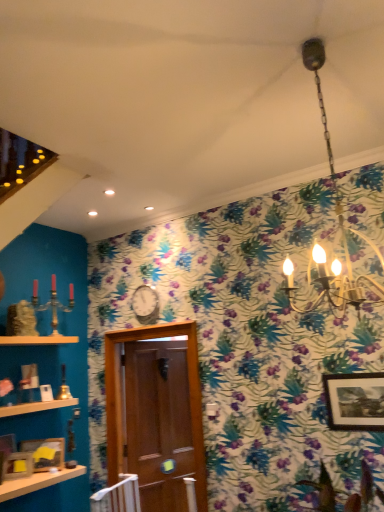
Question: From the image's perspective, is wooden picture frame at upper right, arranged as the fourth picture frame when viewed from the left, above or below wooden picture frame at lower left, positioned as the 2th picture frame in right-to-left order?

Choices:
 (A) above
 (B) below

Answer: (A)

Question: From a real-world perspective, relative to wooden picture frame at lower left, positioned as the 2th picture frame in right-to-left order, is wooden picture frame at upper right, the 1th picture frame positioned from the right, vertically above or below?

Choices:
 (A) above
 (B) below

Answer: (A)

Question: Estimate the real-world distances between objects in this image. Which object is farther from the wooden photo frame at lower left, positioned as the 2th picture frame in left-to-right order?

Choices:
 (A) wooden shelf at lower left, marked as the 1th shelf in a bottom-to-top arrangement
 (B) wooden shelf at lower left
 (C) wooden shelf at lower left, the 1th shelf positioned from the top
 (D) wooden picture frame at upper right, arranged as the fourth picture frame when viewed from the left
 (E) brown wooden door at center

Answer: (D)

Question: Estimate the real-world distances between objects in this image. Which object is farther from the wooden shelf at lower left, the 2th shelf when ordered from top to bottom?

Choices:
 (A) gold metallic chandelier at upper center
 (B) wooden picture frame at lower left, the first picture frame from the left
 (C) brown wooden door at center
 (D) metallic silver clock at center
 (E) wooden shelf at lower left

Answer: (A)